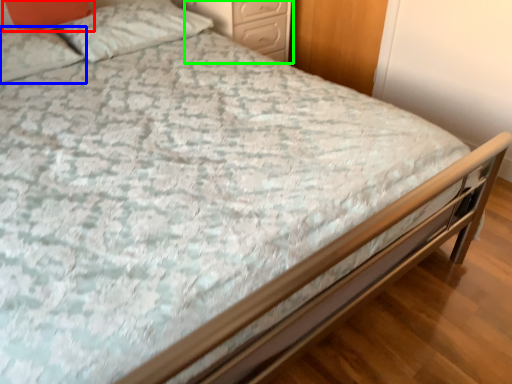
Question: Estimate the real-world distances between objects in this image. Which object is closer to pillow (highlighted by a red box), pillow (highlighted by a blue box) or nightstand (highlighted by a green box)?

Choices:
 (A) pillow
 (B) nightstand

Answer: (A)